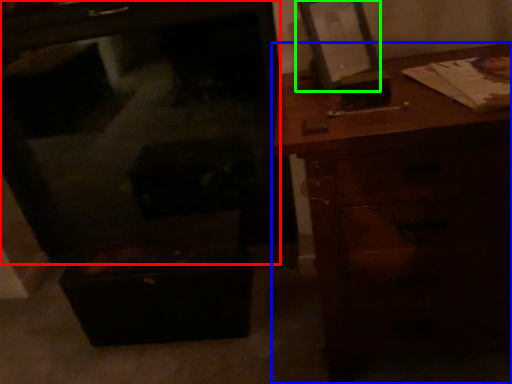
Question: Which object is the farthest from furniture (highlighted by a red box)? Choose among these: chest of drawers (highlighted by a blue box) or picture frame (highlighted by a green box).

Choices:
 (A) chest of drawers
 (B) picture frame

Answer: (B)